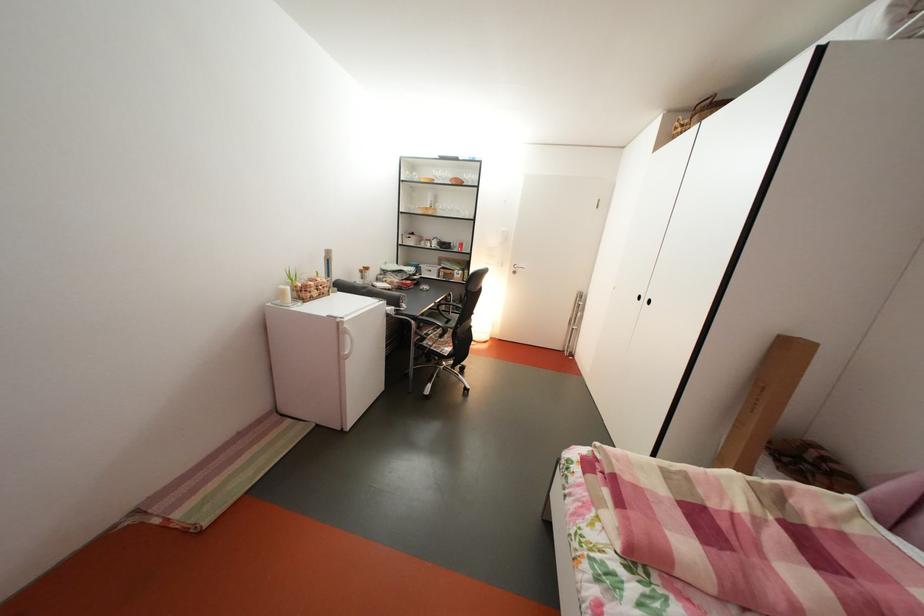
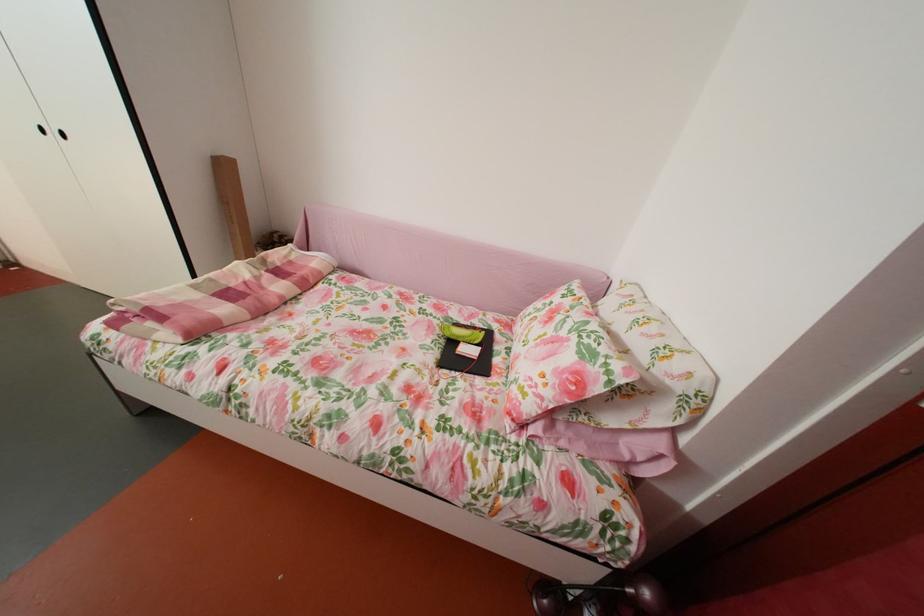
Find the pixel in the second image that matches the point at 783,524 in the first image.

(274, 278)